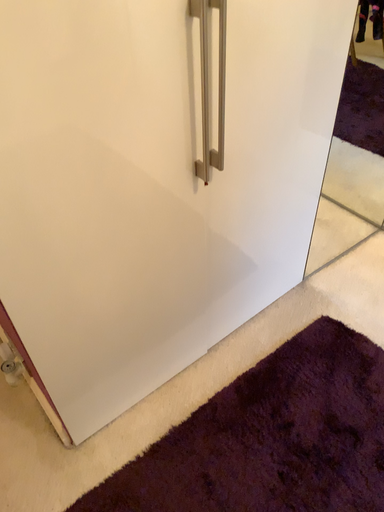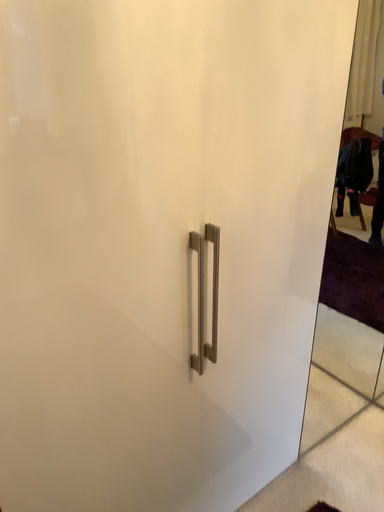
Question: Which way did the camera rotate in the video?

Choices:
 (A) rotated downward
 (B) rotated upward

Answer: (B)